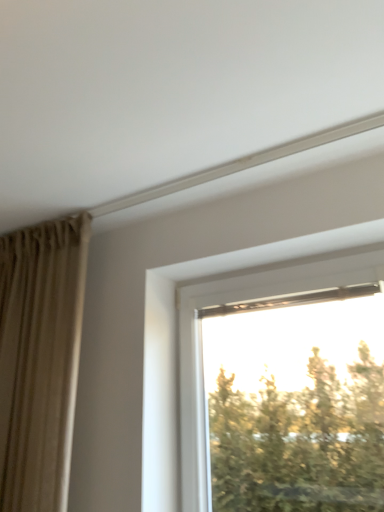
You are a GUI agent. You are given a task and a screenshot of the screen. Output one action in this format:
    pyautogui.click(x=<x>, y=<y>)
    Task: Click on the beige fabric curtain at left
    The height and width of the screenshot is (512, 384).
    Given the screenshot: What is the action you would take?
    pyautogui.click(x=40, y=360)

Describe the element at coordinates (40, 360) in the screenshot. I see `beige fabric curtain at left` at that location.

What are the coordinates of `beige fabric curtain at left` in the screenshot? It's located at (40, 360).